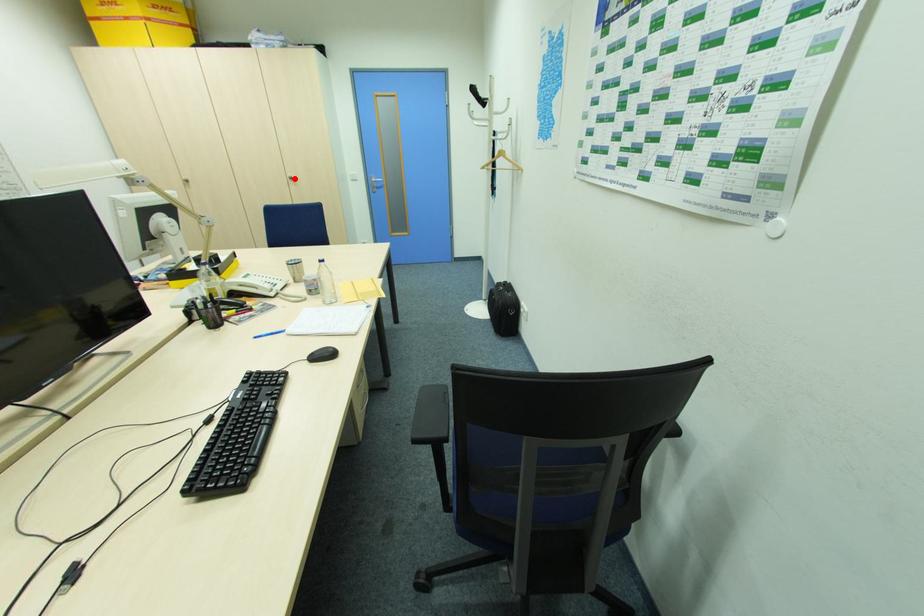
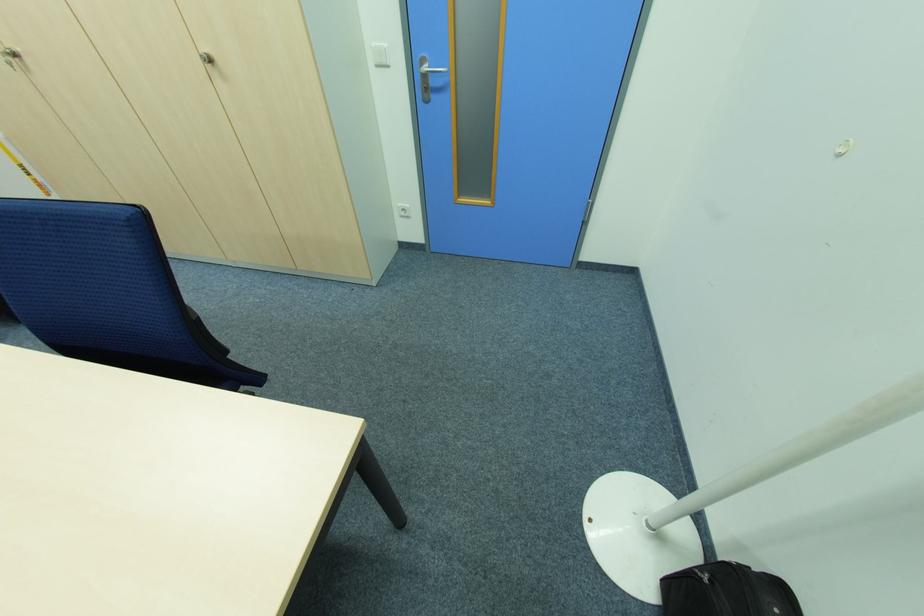
Question: I am providing you with two images of the same scene from different viewpoints. Given a red point in image1, look at the same physical point in image2. Is it:

Choices:
 (A) Closer to the viewpoint
 (B) Farther from the viewpoint

Answer: (B)